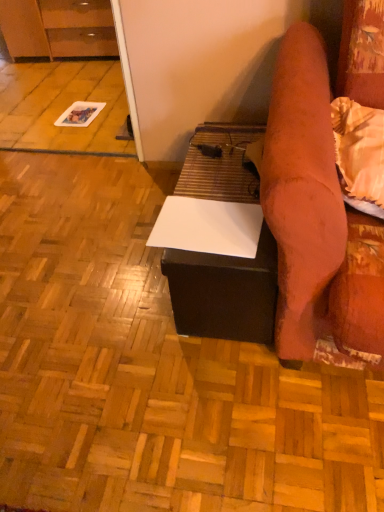
Find the location of a particular element. The height and width of the screenshot is (512, 384). vacant space in front of white matte table at center is located at coordinates (223, 413).